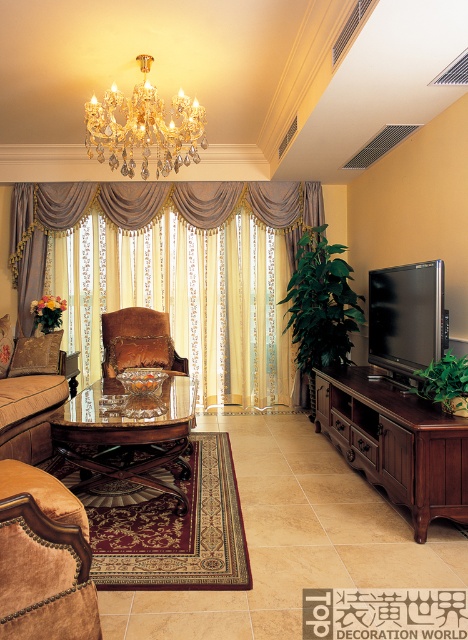
Does point (117, 278) come behind point (190, 445)?

Yes, it is.

Can you confirm if silky beige curtain at center is smaller than velvet brown chair at center?

Actually, silky beige curtain at center might be larger than velvet brown chair at center.

Is point (49, 246) positioned behind point (108, 355)?

Yes.

I want to click on silky beige curtain at center, so click(x=178, y=285).

Is brown wood tv stand at right to the left of suede couch at left from the viewer's perspective?

Incorrect, brown wood tv stand at right is not on the left side of suede couch at left.

Can you confirm if brown wood tv stand at right is positioned to the right of suede couch at left?

Indeed, brown wood tv stand at right is positioned on the right side of suede couch at left.

This screenshot has height=640, width=468. What do you see at coordinates (396, 442) in the screenshot?
I see `brown wood tv stand at right` at bounding box center [396, 442].

I want to click on brown wood tv stand at right, so click(x=396, y=442).

Can you confirm if silky beige curtain at center is bigger than suede couch at left?

Indeed, silky beige curtain at center has a larger size compared to suede couch at left.

Is point (12, 211) farther from camera compared to point (16, 371)?

That is True.

Who is more forward, (160,257) or (34,460)?

Point (34,460) is more forward.

Find the location of a particular element. The height and width of the screenshot is (640, 468). silky beige curtain at center is located at coordinates (178, 285).